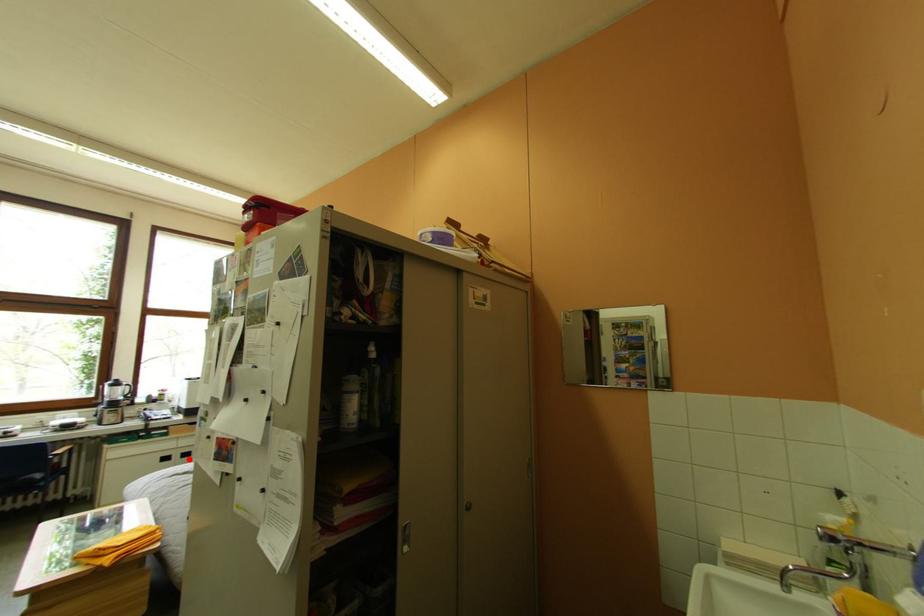
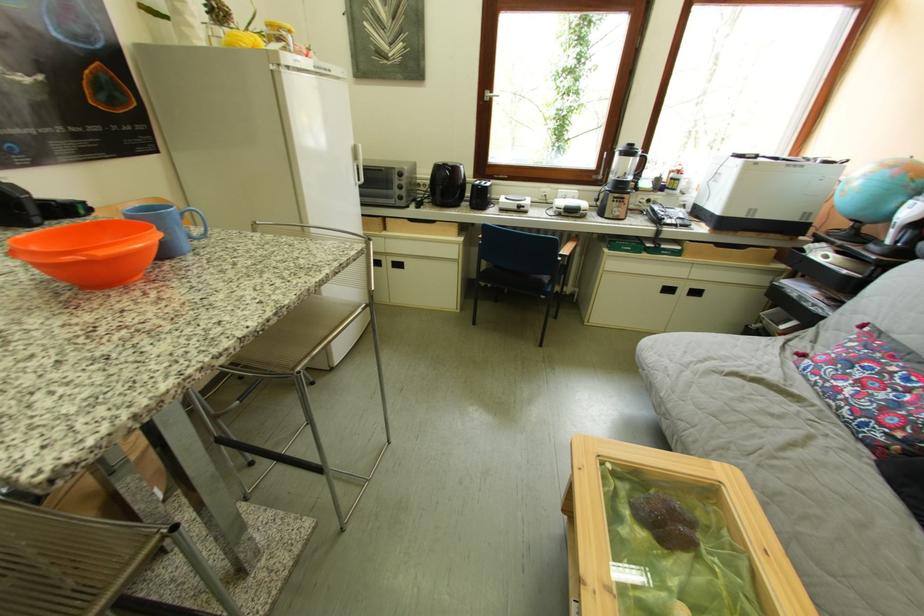
Where in the second image is the point corresponding to the highlighted location from the first image?

(695, 294)